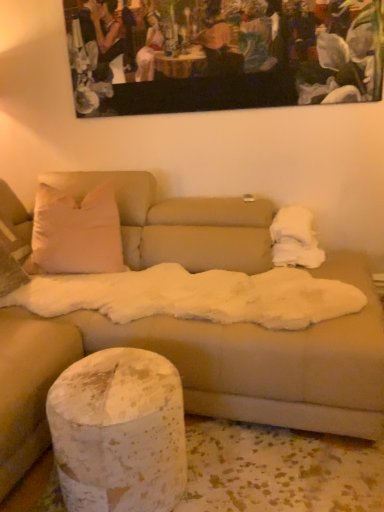
Question: Considering the positions of wooden painting at upper center and white fluffy blanket at upper right in the image, is wooden painting at upper center bigger or smaller than white fluffy blanket at upper right?

Choices:
 (A) small
 (B) big

Answer: (B)

Question: Looking at their shapes, would you say wooden painting at upper center is wider or thinner than white fluffy blanket at upper right?

Choices:
 (A) wide
 (B) thin

Answer: (B)

Question: Which object is the farthest from the wooden painting at upper center?

Choices:
 (A) white fluffy blanket at upper right
 (B) speckled white cylinder at lower left

Answer: (B)

Question: Which object is the closest to the white fluffy blanket at upper right?

Choices:
 (A) wooden painting at upper center
 (B) speckled white cylinder at lower left

Answer: (A)